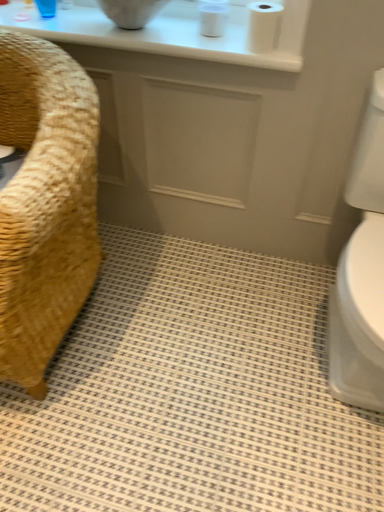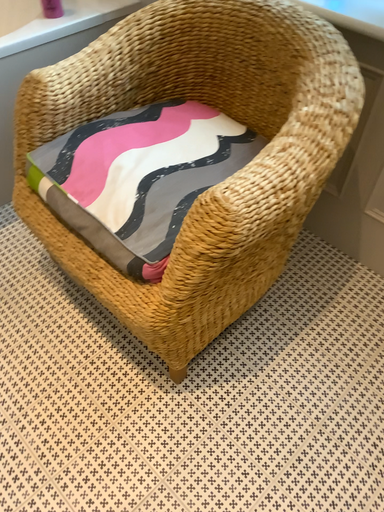
Question: How did the camera likely rotate when shooting the video?

Choices:
 (A) rotated right
 (B) rotated left

Answer: (B)